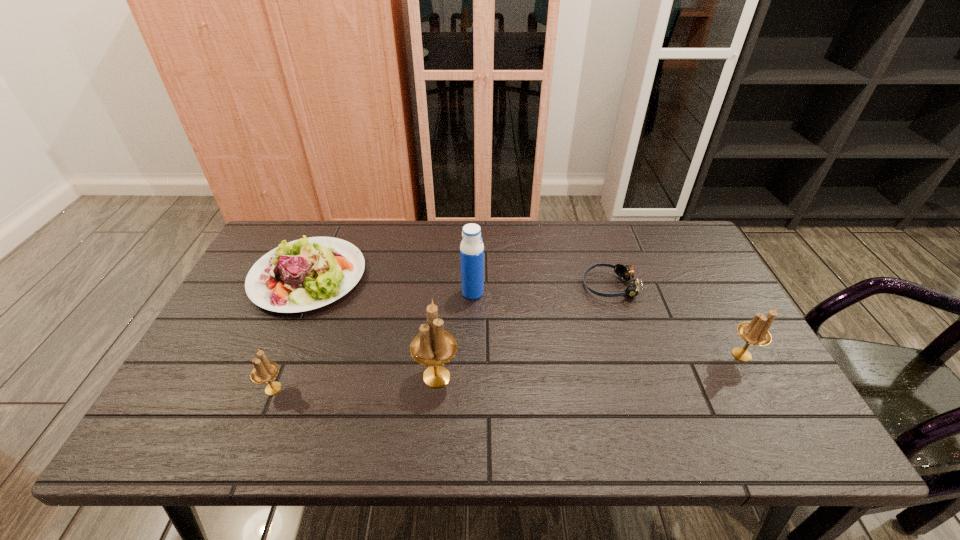
You are a GUI agent. You are given a task and a screenshot of the screen. Output one action in this format:
    pyautogui.click(x=<x>, y=<y>)
    Task: Click on the free region that satisfies the following two spatial constraints: 1. through the lenses of the goggles; 2. on the front side of the tallest candle holder
    The image size is (960, 540).
    Given the screenshot: What is the action you would take?
    pyautogui.click(x=639, y=377)

The width and height of the screenshot is (960, 540). In order to click on free space that satisfies the following two spatial constraints: 1. on the back side of the second candle holder from left to right; 2. on the left side of the water bottle in this screenshot , I will do `click(444, 292)`.

The image size is (960, 540). What are the coordinates of `free space that satisfies the following two spatial constraints: 1. on the front side of the third tallest object; 2. on the left side of the water bottle` in the screenshot? It's located at (471, 354).